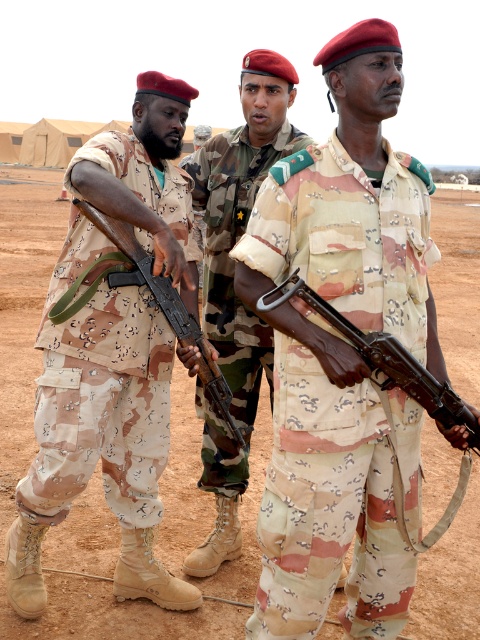
Can you confirm if camouflage fabric pants at left is bigger than camouflage fabric uniform at center?

Yes.

Is camouflage fabric pants at left positioned at the back of camouflage fabric uniform at center?

That is False.

Identify the location of camouflage fabric pants at left. (99, 394).

This screenshot has height=640, width=480. In order to click on camouflage fabric pants at left in this screenshot , I will do `click(99, 394)`.

Between camouflage fabric uniform at center and matte brown rifle at center, which one appears on the right side from the viewer's perspective?

From the viewer's perspective, matte brown rifle at center appears more on the right side.

Which is behind, point (204, 310) or point (367, 339)?

Positioned behind is point (204, 310).

Find the location of `camouflage fabric uniform at center`. camouflage fabric uniform at center is located at coordinates (232, 291).

Can you confirm if camouflage fabric uniform at center is smaller than wooden rifle at center?

No, camouflage fabric uniform at center is not smaller than wooden rifle at center.

Between camouflage fabric uniform at center and wooden rifle at center, which one appears on the right side from the viewer's perspective?

camouflage fabric uniform at center

Does point (216, 248) lie in front of point (157, 300)?

No, it is not.

The height and width of the screenshot is (640, 480). What are the coordinates of `camouflage fabric uniform at center` in the screenshot? It's located at (232, 291).